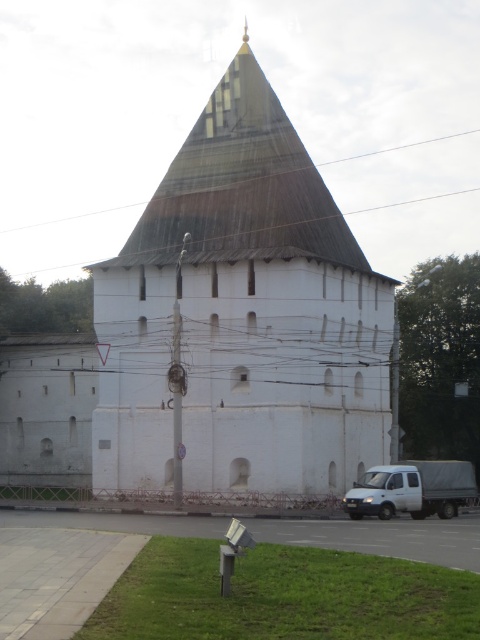
Who is shorter, white matte truck at lower right or brown wooden power line at upper center?

white matte truck at lower right is shorter.

This screenshot has height=640, width=480. What do you see at coordinates (411, 490) in the screenshot? I see `white matte truck at lower right` at bounding box center [411, 490].

Is point (365, 493) positioned behind point (319, 164)?

No.

Where is `white matte truck at lower right`? This screenshot has width=480, height=640. white matte truck at lower right is located at coordinates (411, 490).

Is point (269, 241) positioned after point (336, 160)?

No, it is not.

Measure the distance between point (264,369) and camera.

Point (264,369) is 226.25 feet from camera.

The image size is (480, 640). In order to click on white stone chapel at center in this screenshot , I will do `click(240, 317)`.

This screenshot has width=480, height=640. What are the coordinates of `white stone chapel at center` in the screenshot? It's located at (240, 317).

What do you see at coordinates (240, 317) in the screenshot?
I see `white stone chapel at center` at bounding box center [240, 317].

Does white stone chapel at center appear under white matte truck at lower right?

No.

Between point (206, 337) and point (381, 499), which one is positioned in front?

Point (381, 499) is more forward.

Locate an element on the screen. This screenshot has width=480, height=640. white stone chapel at center is located at coordinates (240, 317).